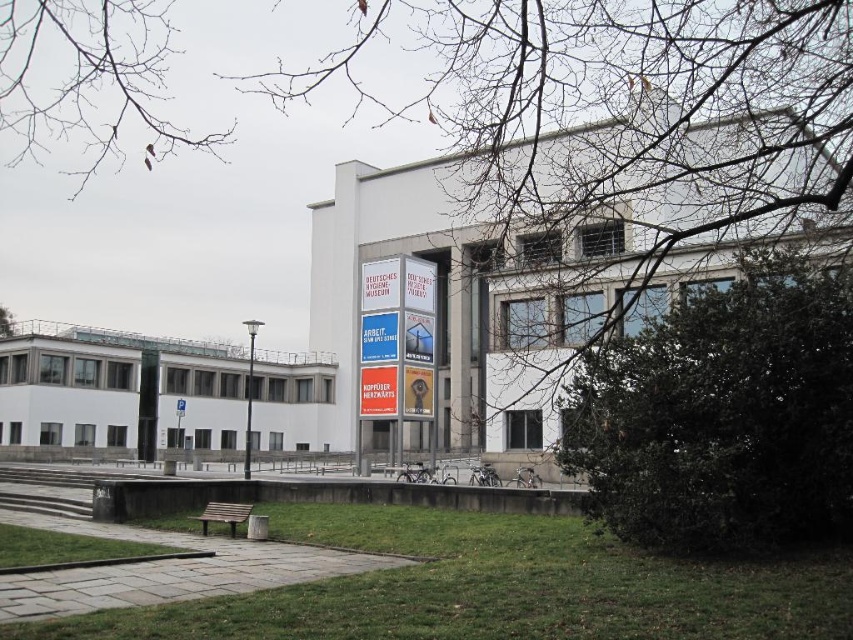
You are standing in front of the Deutsches Hygiene Museum and want to sit on the bench located behind the dark green leafy bush at center right. Can you estimate how far you need to walk to reach the bench?

The dark green leafy bush at center right is 53.60 feet away from the viewer. Since the bench is behind it, you would need to walk approximately 53.60 feet to reach the bench.

Based on the scene description, which object is taller when comparing the dark green leafy bush at center right and the bare branches at upper left?

The dark green leafy bush at center right is shorter than the bare branches at upper left.

You are standing in front of the Deutsches Hygiene Museum and want to take a photo of the signboard. There are a dark green leafy bush at center right and bare branches at upper left in your view. Which object is closer to you, the photographer, so you can decide if you need to move to avoid it blocking the signboard?

The dark green leafy bush at center right is closer to you than the bare branches at upper left, so you should move to avoid it blocking the signboard.